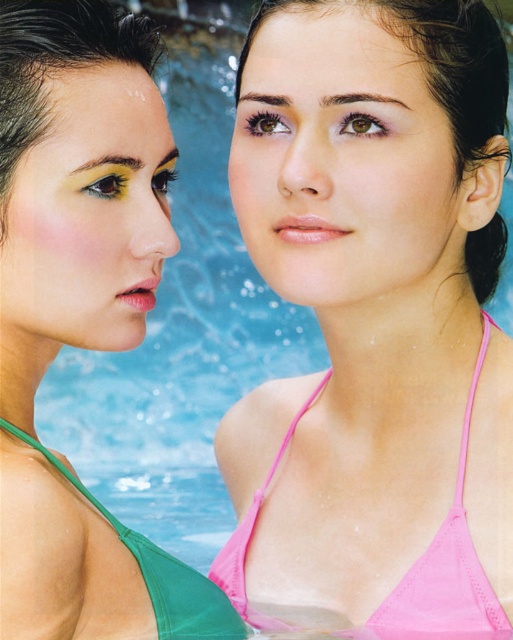
You are a photographer adjusting your camera settings to focus on the pink fabric bikini top at center. Which direction should you move your camera to capture the matte pink bikini top at upper right in the frame?

You should move the camera to the left to capture the matte pink bikini top at upper right since it is positioned to the left of the pink fabric bikini top at center.

You are a photographer adjusting the focus on your camera. You need to capture a closeup of both the matte pink bikini top at upper right and the green matte bikini top at lower left in the same frame. Given that your camera can only focus on objects within a 15 inch range, will you be able to achieve this without moving the camera?

The matte pink bikini top at upper right is 19.92 inches away from the green matte bikini top at lower left. Since the distance exceeds the camera focus range of 15 inches, you won cannot capture both in focus without adjusting the camera position.